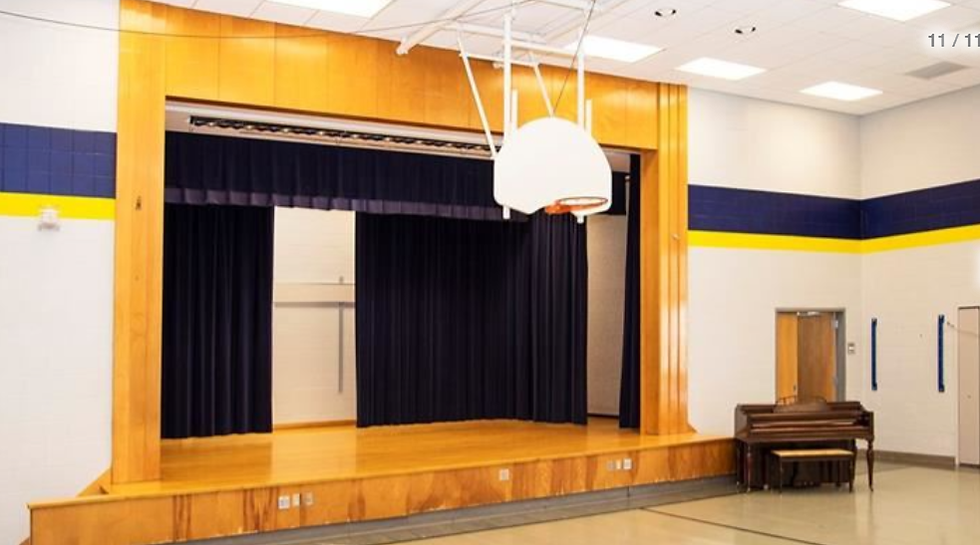
The image size is (980, 545). What are the coordinates of `stage platform` in the screenshot? It's located at (464, 459).